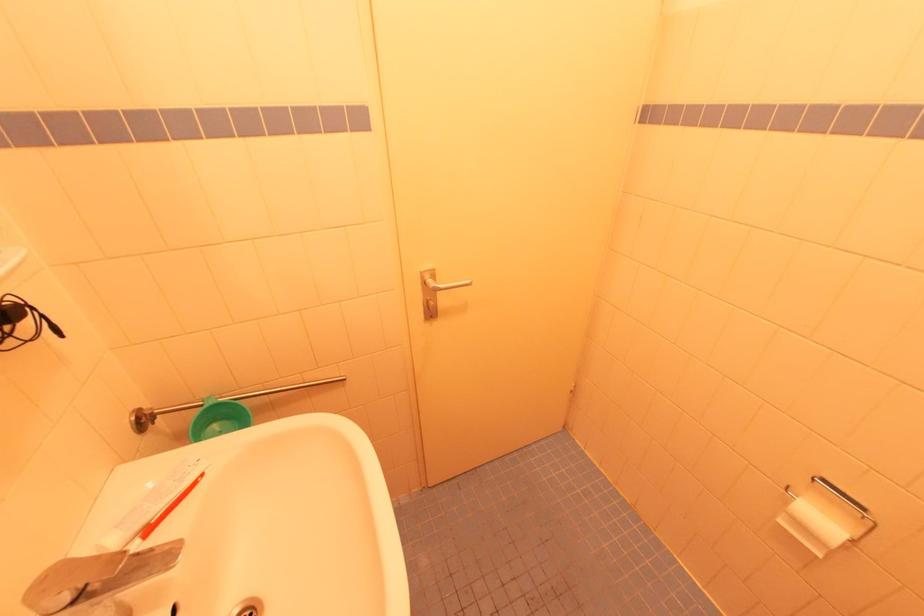
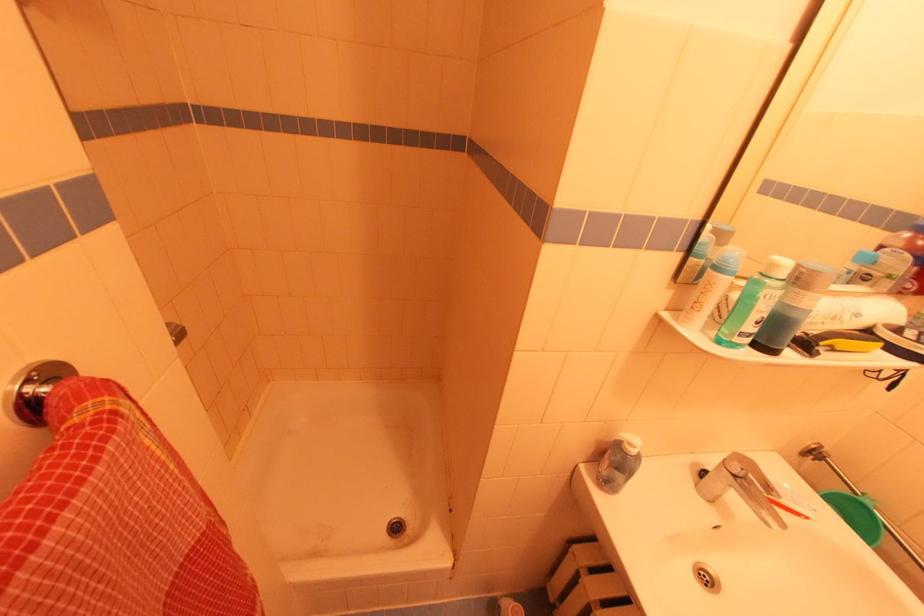
First-person continuous shooting, in which direction is the camera rotating?

The rotation direction of the camera is left-down.